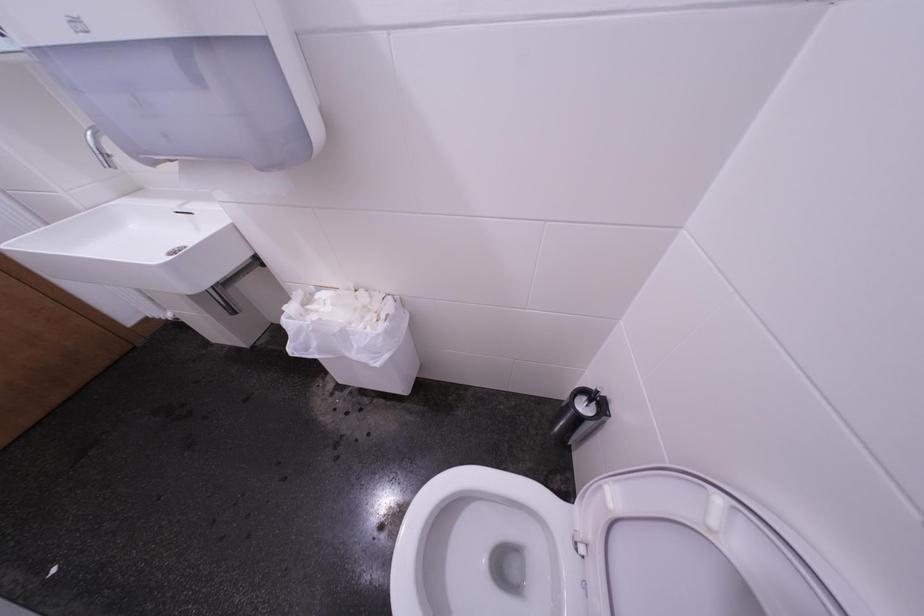
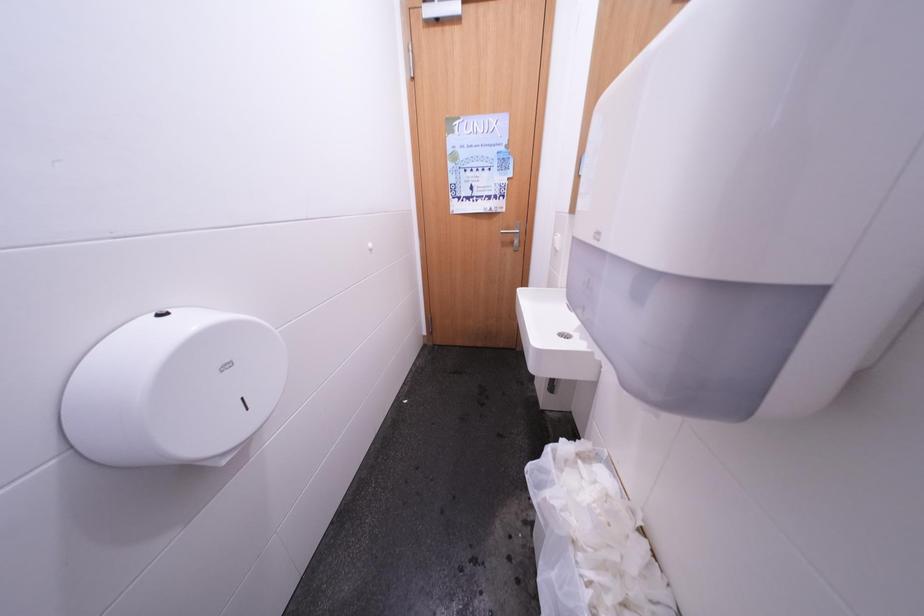
Question: Based on the continuous images, in which direction is the camera rotating? Reply with the corresponding letter.

Choices:
 (A) Left
 (B) Right
 (C) Up
 (D) Down

Answer: (A)